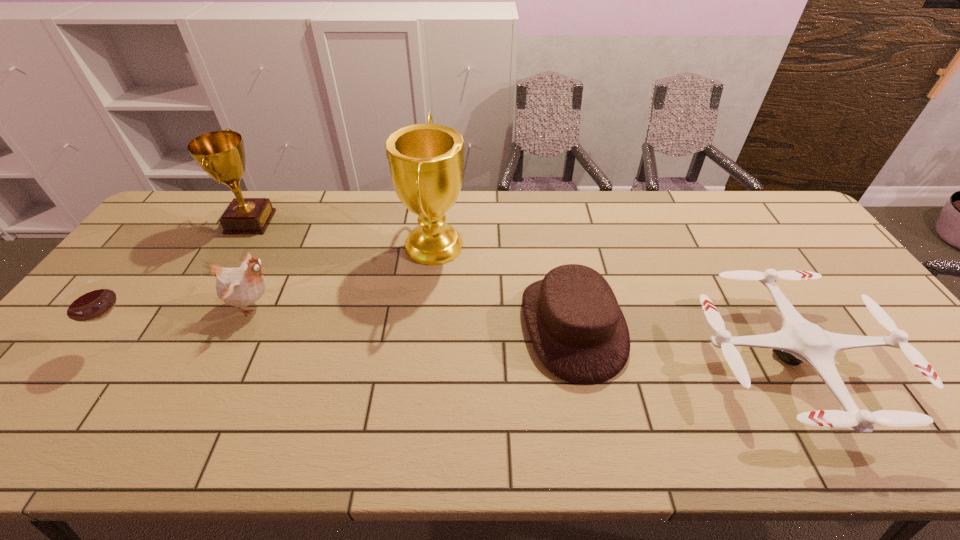
Locate an element on the screen. This screenshot has width=960, height=540. free area in between the shorter award and the drone is located at coordinates (520, 292).

This screenshot has height=540, width=960. Find the location of `unoccupied position between the bird and the tallest object`. unoccupied position between the bird and the tallest object is located at coordinates (344, 274).

Where is `free point between the bird and the fifth object from left to right`? free point between the bird and the fifth object from left to right is located at coordinates point(413,315).

I want to click on vacant area between the fifth shortest object and the hat, so click(x=412, y=274).

Locate which object ranks fourth in proximity to the rightmost object. Please provide its 2D coordinates. Your answer should be formatted as a tuple, i.e. [(x, y)], where the tuple contains the x and y coordinates of a point satisfying the conditions above.

[(221, 154)]

At what (x,y) coordinates should I click in order to perform the action: click on the fourth closest object to the leftmost object. Please return your answer as a coordinate pair (x, y). Looking at the image, I should click on (578, 331).

The height and width of the screenshot is (540, 960). I want to click on vacant space that satisfies the following two spatial constraints: 1. on the shiny surface of the tallest object; 2. on the left side of the hat, so click(x=425, y=326).

I want to click on vacant point that satisfies the following two spatial constraints: 1. on the plaque of the hat; 2. on the left side of the second tallest object, so click(189, 326).

The height and width of the screenshot is (540, 960). Find the location of `free space that satisfies the following two spatial constraints: 1. on the shiny surface of the tallest object; 2. on the right side of the hat`. free space that satisfies the following two spatial constraints: 1. on the shiny surface of the tallest object; 2. on the right side of the hat is located at coordinates (425, 326).